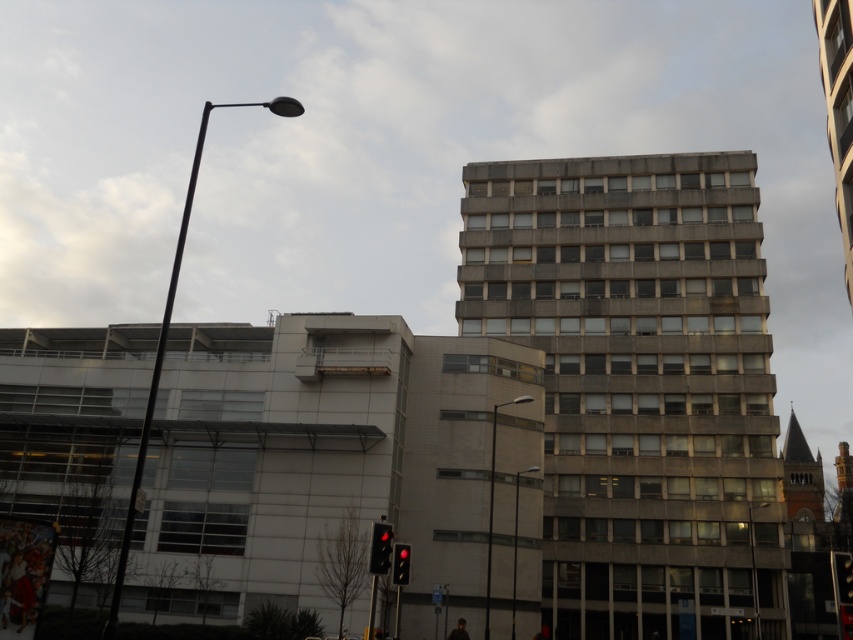
Can you confirm if metallic pole at center is wider than red glass traffic light at lower center?

Correct, the width of metallic pole at center exceeds that of red glass traffic light at lower center.

Which is behind, point (756, 632) or point (404, 580)?

Positioned behind is point (756, 632).

This screenshot has width=853, height=640. In order to click on metallic pole at center in this screenshot , I will do `click(753, 566)`.

Can you confirm if black metal street light at upper left is bigger than red brick tower at right?

Yes.

Which is in front, point (198, 166) or point (820, 472)?

Positioned in front is point (820, 472).

Identify the location of black metal street light at upper left. The width and height of the screenshot is (853, 640). (166, 339).

Between black metal street light at upper left and black glass street light at center, which one has more height?

→ Standing taller between the two is black metal street light at upper left.

Does black metal street light at upper left appear on the right side of black glass street light at center?

Incorrect, black metal street light at upper left is not on the right side of black glass street light at center.

What do you see at coordinates (166, 339) in the screenshot? The width and height of the screenshot is (853, 640). I see `black metal street light at upper left` at bounding box center [166, 339].

I want to click on black metal street light at upper left, so click(166, 339).